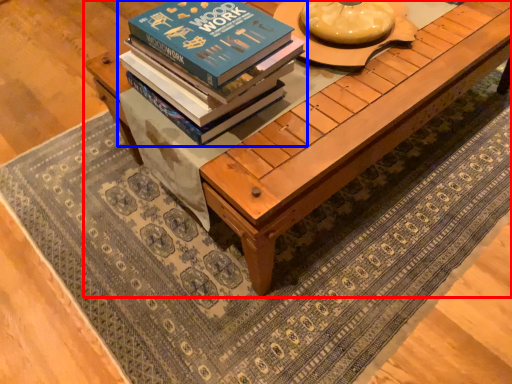
Question: Which of the following is the farthest to the observer, table (highlighted by a red box) or book (highlighted by a blue box)?

Choices:
 (A) table
 (B) book

Answer: (A)